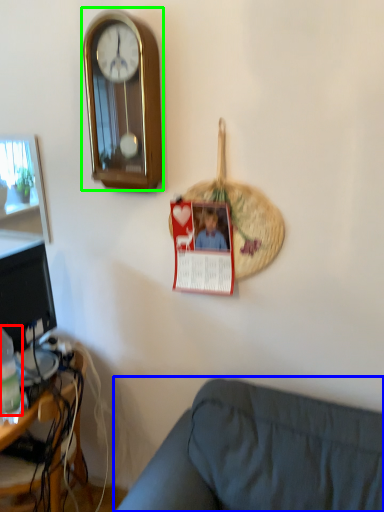
Question: Which object is the closest to the bottle (highlighted by a red box)? Choose among these: studio couch (highlighted by a blue box) or wall clock (highlighted by a green box).

Choices:
 (A) studio couch
 (B) wall clock

Answer: (A)